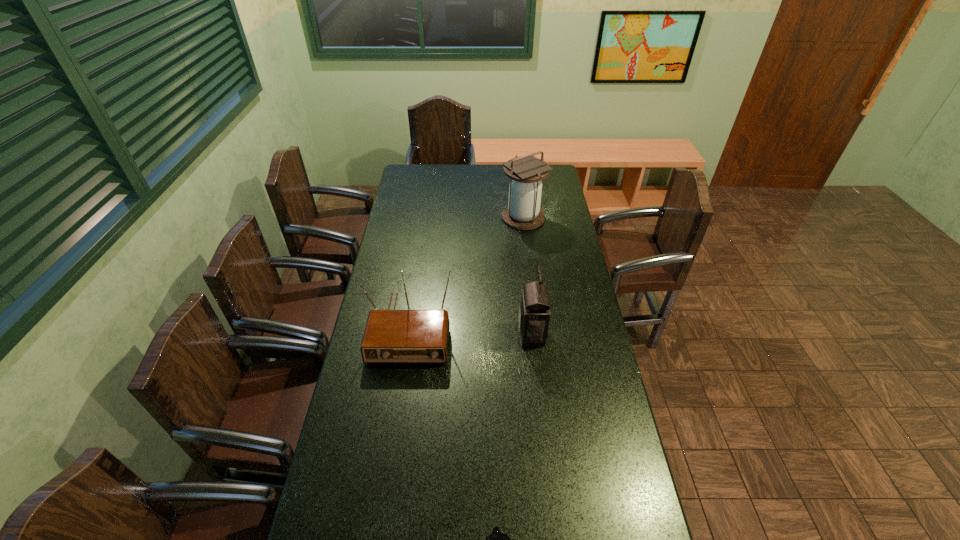
The height and width of the screenshot is (540, 960). In order to click on free space at the far edge of the desktop in this screenshot , I will do click(465, 171).

The width and height of the screenshot is (960, 540). In the image, there is a desktop. What are the coordinates of `blank space at the left edge` in the screenshot? It's located at (413, 292).

Where is `vacant area at the right edge of the desktop`? The width and height of the screenshot is (960, 540). vacant area at the right edge of the desktop is located at coordinates coord(557,252).

Where is `free space between the second nearest lantern and the leftmost object`? free space between the second nearest lantern and the leftmost object is located at coordinates (470, 330).

At what (x,y) coordinates should I click in order to perform the action: click on blank region between the leftmost object and the farthest object. Please return your answer as a coordinate pair (x, y). This screenshot has height=540, width=960. Looking at the image, I should click on (466, 272).

The height and width of the screenshot is (540, 960). Find the location of `free space between the farthest lantern and the radio_receiver`. free space between the farthest lantern and the radio_receiver is located at coordinates (466, 272).

You are a GUI agent. You are given a task and a screenshot of the screen. Output one action in this format:
    pyautogui.click(x=<x>, y=<y>)
    Task: Click on the vacant area that lies between the leftmost object and the farthest lantern
    The height and width of the screenshot is (540, 960).
    Given the screenshot: What is the action you would take?
    pyautogui.click(x=466, y=272)

The width and height of the screenshot is (960, 540). I want to click on unoccupied area between the second nearest lantern and the farthest object, so click(528, 276).

This screenshot has height=540, width=960. In order to click on vacant space that is in between the farthest lantern and the second nearest lantern in this screenshot , I will do `click(528, 276)`.

Identify which object is located as the second nearest to the farthest lantern. Please provide its 2D coordinates. Your answer should be formatted as a tuple, i.e. [(x, y)], where the tuple contains the x and y coordinates of a point satisfying the conditions above.

[(534, 311)]